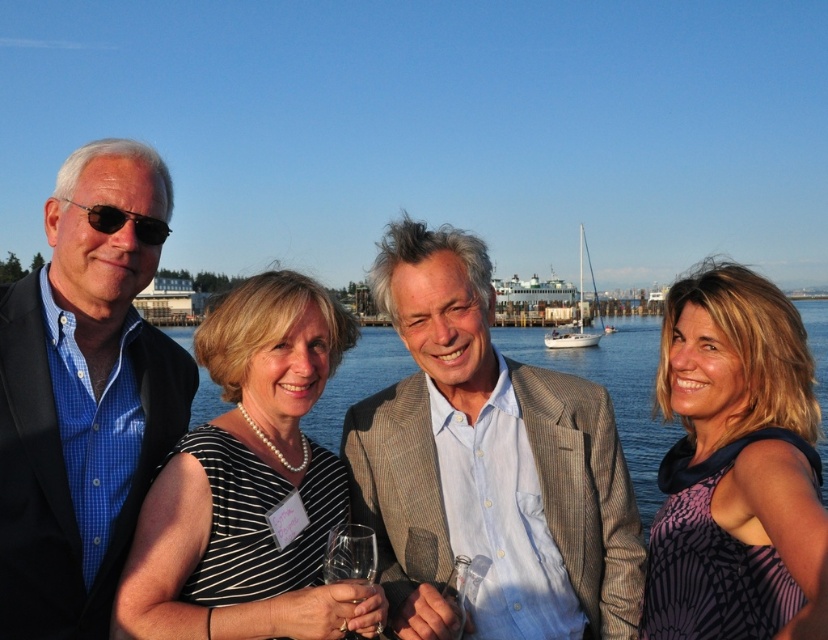
Question: Does purple printed dress at center have a lesser width compared to white matte sailboat at center?

Choices:
 (A) no
 (B) yes

Answer: (B)

Question: Which object is the closest to the clear glass wine glass at center?

Choices:
 (A) light brown textured blazer at center
 (B) matte black suit at left

Answer: (A)

Question: Based on their relative distances, which object is nearer to the clear blue water at center?

Choices:
 (A) purple printed dress at center
 (B) light brown textured blazer at center

Answer: (A)

Question: Among these objects, which one is nearest to the camera?

Choices:
 (A) matte black suit at left
 (B) matte black sunglasses at left
 (C) purple printed dress at center

Answer: (C)

Question: Is light brown textured blazer at center thinner than matte black suit at left?

Choices:
 (A) yes
 (B) no

Answer: (B)

Question: Can you confirm if clear blue water at center is positioned to the left of matte black sunglasses at left?

Choices:
 (A) yes
 (B) no

Answer: (B)